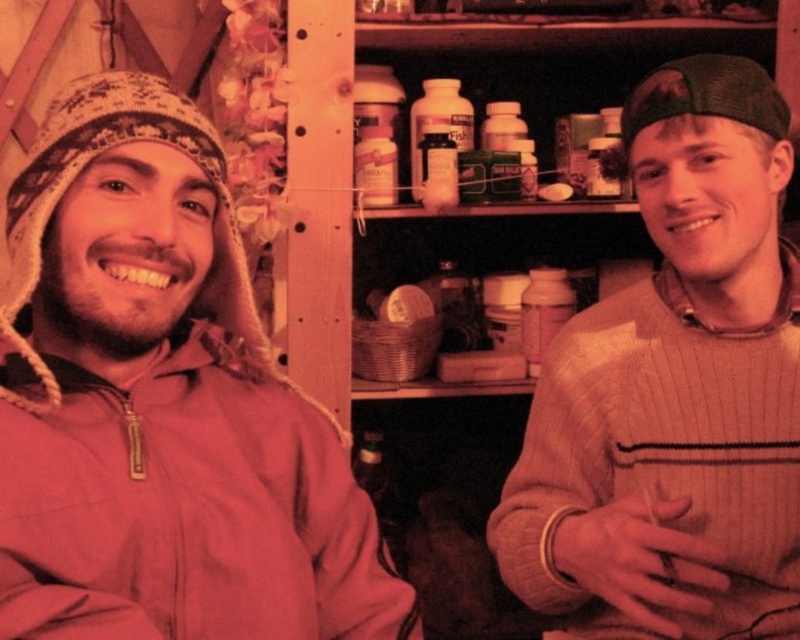
Between knitted sweater at right and green fabric cap at upper right, which one is positioned higher?

Positioned higher is green fabric cap at upper right.

Who is positioned more to the right, knitted sweater at right or green fabric cap at upper right?

green fabric cap at upper right

Is point (692, 355) positioned behind point (721, 56)?

Yes, it is.

This screenshot has height=640, width=800. Identify the location of knitted sweater at right. (676, 392).

Is matte pink jacket at left closer to the viewer compared to green fabric cap at upper right?

Yes.

Is matte pink jacket at left above green fabric cap at upper right?

Actually, matte pink jacket at left is below green fabric cap at upper right.

Where is `matte pink jacket at left`? matte pink jacket at left is located at coordinates (162, 406).

Locate an element on the screen. This screenshot has width=800, height=640. matte pink jacket at left is located at coordinates (162, 406).

In the scene shown: Is matte pink jacket at left to the right of knitted sweater at right from the viewer's perspective?

Incorrect, matte pink jacket at left is not on the right side of knitted sweater at right.

Between point (132, 289) and point (705, 561), which one is positioned in front?

Positioned in front is point (132, 289).

Find the location of a particular element. matte pink jacket at left is located at coordinates coord(162,406).